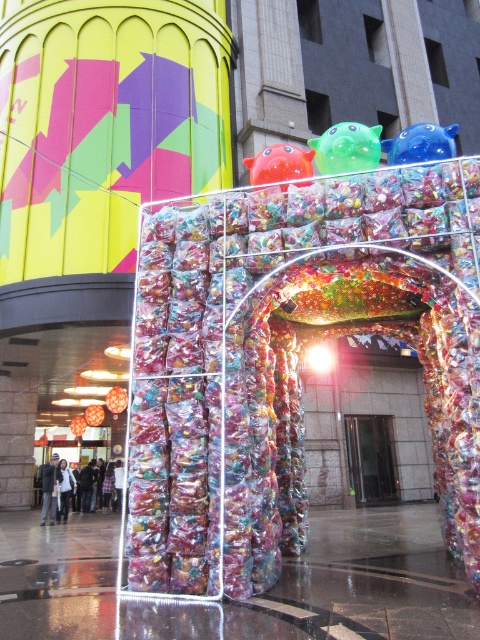
Question: Which object is closer to the camera taking this photo?

Choices:
 (A) glossy plastic ball at upper center
 (B) blue glossy toy at upper right

Answer: (B)

Question: Which of these objects is positioned farthest from the glossy plastic ball at upper center?

Choices:
 (A) green rubber toy at center
 (B) blue glossy toy at upper right

Answer: (B)

Question: Is green rubber toy at center smaller than blue glossy toy at upper right?

Choices:
 (A) yes
 (B) no

Answer: (A)

Question: Can you confirm if green rubber toy at center is smaller than blue glossy toy at upper right?

Choices:
 (A) no
 (B) yes

Answer: (B)

Question: Which point is farther from the camera taking this photo?

Choices:
 (A) (398, 161)
 (B) (315, 161)

Answer: (B)

Question: Does green rubber toy at center have a larger size compared to glossy plastic ball at upper center?

Choices:
 (A) yes
 (B) no

Answer: (B)